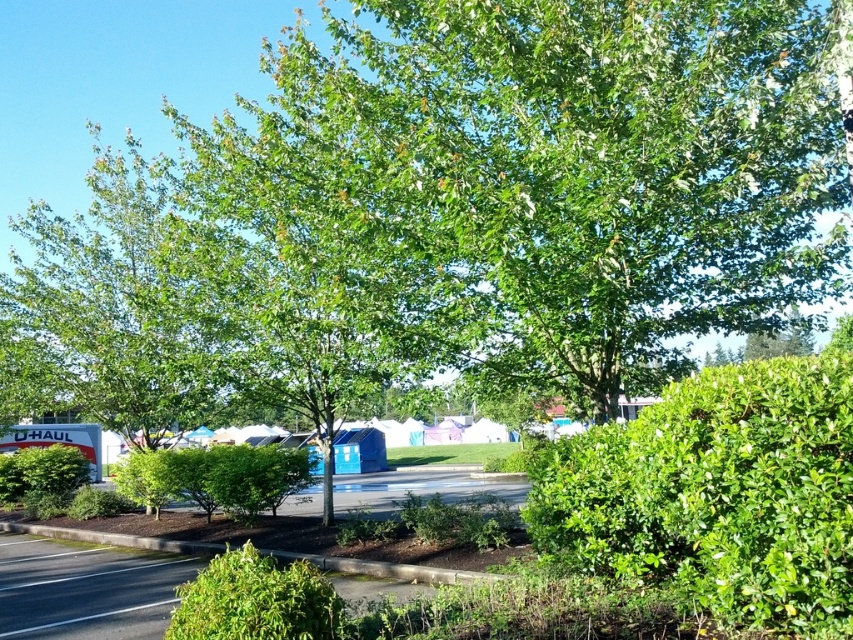
Question: Does green leafy bush at lower center appear over green leafy bush at center?

Choices:
 (A) no
 (B) yes

Answer: (B)

Question: Which object is positioned farthest from the brown concrete curb at lower center?

Choices:
 (A) green leafy hedge at center right
 (B) green leafy bush at lower center

Answer: (B)

Question: Which point is closer to the camera taking this photo?

Choices:
 (A) (322, 628)
 (B) (234, 454)
 (C) (51, 476)
 (D) (466, 573)

Answer: (A)

Question: Can you confirm if brown concrete curb at lower center is positioned below green leafy bush at lower left?

Choices:
 (A) yes
 (B) no

Answer: (B)

Question: Which of the following is the closest to the observer?

Choices:
 (A) (312, 556)
 (B) (286, 470)

Answer: (A)

Question: Does green leafy hedge at center right have a smaller size compared to green leafy bush at center?

Choices:
 (A) yes
 (B) no

Answer: (B)